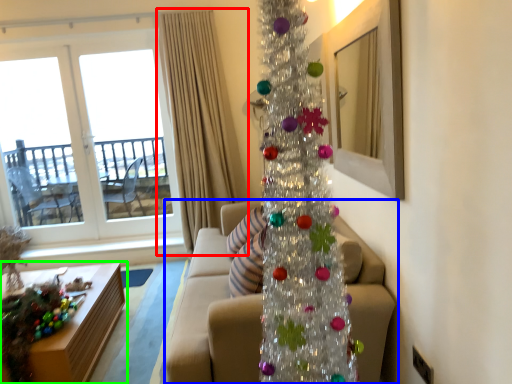
Question: Which object is positioned closest to curtain (highlighted by a red box)? Select from studio couch (highlighted by a blue box) and table (highlighted by a green box).

Choices:
 (A) studio couch
 (B) table

Answer: (A)